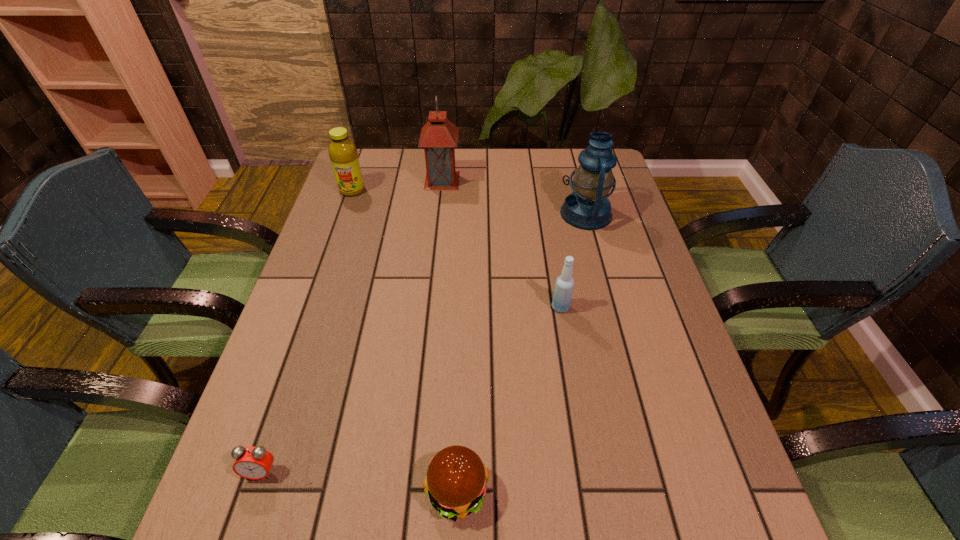
The image size is (960, 540). In order to click on vacant space that satisfies the following two spatial constraints: 1. on the front side of the bottle; 2. on the left side of the farther lantern in this screenshot , I will do (429, 307).

I want to click on vacant region that satisfies the following two spatial constraints: 1. on the front label of the hamburger; 2. on the right side of the fruit juice, so click(249, 491).

The width and height of the screenshot is (960, 540). I want to click on blank space that satisfies the following two spatial constraints: 1. on the front label of the fruit juice; 2. on the right side of the fourth farthest object, so click(x=312, y=307).

Where is `vacant region that satisfies the following two spatial constraints: 1. on the face of the rightmost object; 2. on the front-facing side of the shortest object`? This screenshot has height=540, width=960. vacant region that satisfies the following two spatial constraints: 1. on the face of the rightmost object; 2. on the front-facing side of the shortest object is located at coordinates (656, 471).